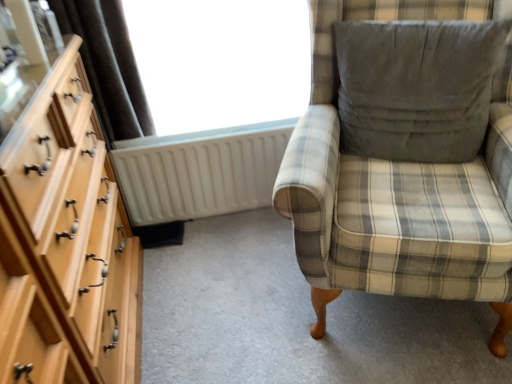
This screenshot has width=512, height=384. Describe the element at coordinates (416, 87) in the screenshot. I see `gray suede pillow at upper right` at that location.

What is the approximate width of white plastic radiator at center?

white plastic radiator at center is 4.04 inches wide.

This screenshot has width=512, height=384. I want to click on gray suede pillow at upper right, so click(x=416, y=87).

Between gray suede pillow at upper right and plaid fabric armchair at right, which one has larger size?

Bigger between the two is plaid fabric armchair at right.

From a real-world perspective, between gray suede pillow at upper right and plaid fabric armchair at right, who is vertically higher?

From a 3D spatial view, gray suede pillow at upper right is above.

You are a GUI agent. You are given a task and a screenshot of the screen. Output one action in this format:
    pyautogui.click(x=<x>, y=<y>)
    Task: Click on the pillow that is on the left side of plaid fabric armchair at right
    
    Given the screenshot: What is the action you would take?
    pyautogui.click(x=416, y=87)

Between transparent glass window at upper center and plaid fabric armchair at right, which one appears on the right side from the viewer's perspective?

plaid fabric armchair at right.

Is transparent glass window at upper center thinner than plaid fabric armchair at right?

Correct, the width of transparent glass window at upper center is less than that of plaid fabric armchair at right.

From the image's perspective, between transparent glass window at upper center and plaid fabric armchair at right, which one is located above?

transparent glass window at upper center.

Between white plastic radiator at center and transparent glass window at upper center, which one has more height?

transparent glass window at upper center is taller.

Between white plastic radiator at center and transparent glass window at upper center, which one appears on the right side from the viewer's perspective?

transparent glass window at upper center.

Does white plastic radiator at center have a larger size compared to transparent glass window at upper center?

No, white plastic radiator at center is not bigger than transparent glass window at upper center.

From a real-world perspective, which is physically below, white plastic radiator at center or transparent glass window at upper center?

white plastic radiator at center, from a real-world perspective.

Is point (184, 156) less distant than point (53, 103)?

No.

At what (x,y) coordinates should I click in order to perform the action: click on radiator behind the light wood dresser at left. Please return your answer as a coordinate pair (x, y). Image resolution: width=512 pixels, height=384 pixels. Looking at the image, I should click on (200, 171).

Looking at this image, from a real-world perspective, is white plastic radiator at center physically located above or below light wood dresser at left?

white plastic radiator at center is situated lower than light wood dresser at left in the real world.

Is white plastic radiator at center looking in the opposite direction of light wood dresser at left?

No, light wood dresser at left is not at the back of white plastic radiator at center.

Which of these two, white plastic radiator at center or gray suede pillow at upper right, is wider?

Wider between the two is gray suede pillow at upper right.

From the picture: Is white plastic radiator at center in front of gray suede pillow at upper right?

No, it is behind gray suede pillow at upper right.

Find the location of a particular element. Image resolution: width=512 pixels, height=384 pixels. radiator below the gray suede pillow at upper right (from the image's perspective) is located at coordinates (200, 171).

Considering the sizes of objects white plastic radiator at center and gray suede pillow at upper right in the image provided, who is taller, white plastic radiator at center or gray suede pillow at upper right?

white plastic radiator at center.

From a real-world perspective, which object rests below the other?

white plastic radiator at center.

Is plaid fabric armchair at right surrounding white plastic radiator at center?

Actually, white plastic radiator at center is outside plaid fabric armchair at right.

The height and width of the screenshot is (384, 512). I want to click on radiator behind the plaid fabric armchair at right, so click(x=200, y=171).

Are white plastic radiator at center and plaid fabric armchair at right far apart?

No.

Based on the photo, based on their positions, is white plastic radiator at center located to the left or right of plaid fabric armchair at right?

Based on their positions, white plastic radiator at center is located to the left of plaid fabric armchair at right.

This screenshot has height=384, width=512. In order to click on pillow to the left of plaid fabric armchair at right in this screenshot , I will do `click(416, 87)`.

This screenshot has width=512, height=384. I want to click on furniture that is in front of the transparent glass window at upper center, so click(x=398, y=191).

Which object lies further to the anchor point plaid fabric armchair at right, white plastic radiator at center or gray suede pillow at upper right?

The object further to plaid fabric armchair at right is white plastic radiator at center.

Which object lies further to the anchor point gray suede pillow at upper right, plaid fabric armchair at right or white plastic radiator at center?

white plastic radiator at center is further to gray suede pillow at upper right.

Estimate the real-world distances between objects in this image. Which object is closer to plaid fabric armchair at right, transparent glass window at upper center or white plastic radiator at center?

transparent glass window at upper center is positioned closer to the anchor plaid fabric armchair at right.

Estimate the real-world distances between objects in this image. Which object is further from plaid fabric armchair at right, transparent glass window at upper center or gray suede pillow at upper right?

transparent glass window at upper center is further to plaid fabric armchair at right.

Which object lies nearer to the anchor point white plastic radiator at center, plaid fabric armchair at right or transparent glass window at upper center?

transparent glass window at upper center.

When comparing their distances from white plastic radiator at center, does transparent glass window at upper center or light wood dresser at left seem further?

Among the two, light wood dresser at left is located further to white plastic radiator at center.

Which object lies nearer to the anchor point white plastic radiator at center, gray suede pillow at upper right or plaid fabric armchair at right?

gray suede pillow at upper right lies closer to white plastic radiator at center than the other object.

Estimate the real-world distances between objects in this image. Which object is further from transparent glass window at upper center, white plastic radiator at center or light wood dresser at left?

light wood dresser at left lies further to transparent glass window at upper center than the other object.

Where is `window located between plaid fabric armchair at right and white plastic radiator at center in the depth direction`? window located between plaid fabric armchair at right and white plastic radiator at center in the depth direction is located at coordinates (221, 61).

Where is `window between light wood dresser at left and white plastic radiator at center from front to back`? The image size is (512, 384). window between light wood dresser at left and white plastic radiator at center from front to back is located at coordinates (221, 61).

Find the location of a particular element. pillow positioned between light wood dresser at left and white plastic radiator at center from near to far is located at coordinates (416, 87).

Where is `pillow between plaid fabric armchair at right and white plastic radiator at center from front to back`? pillow between plaid fabric armchair at right and white plastic radiator at center from front to back is located at coordinates (416, 87).